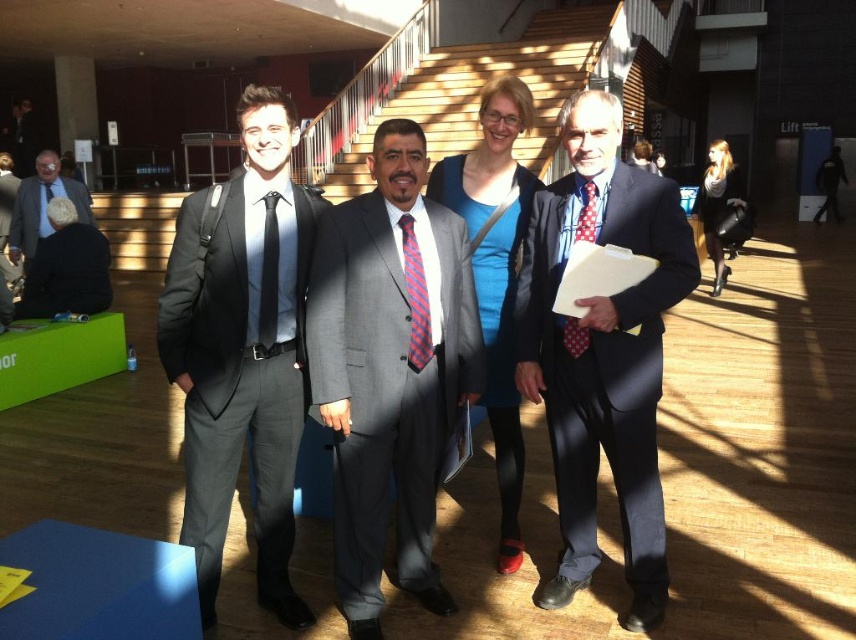
Question: Does gray suit at center lie behind blue fabric dress at center?

Choices:
 (A) no
 (B) yes

Answer: (A)

Question: Does matte black suit at left appear over blonde hair at upper right?

Choices:
 (A) no
 (B) yes

Answer: (B)

Question: Can you confirm if gray suit at center is wider than matte black suit at left?

Choices:
 (A) yes
 (B) no

Answer: (B)

Question: Which of the following is the farthest from the observer?

Choices:
 (A) (354, 634)
 (B) (715, 237)
 (C) (646, 296)
 (D) (74, 196)

Answer: (B)

Question: Which point is farther from the camera taking this photo?

Choices:
 (A) click(263, 268)
 (B) click(724, 278)
 (C) click(491, 195)

Answer: (B)

Question: Considering the real-world distances, which object is closest to the gray wool suit at left?

Choices:
 (A) blonde hair at upper right
 (B) gray suit at center

Answer: (B)